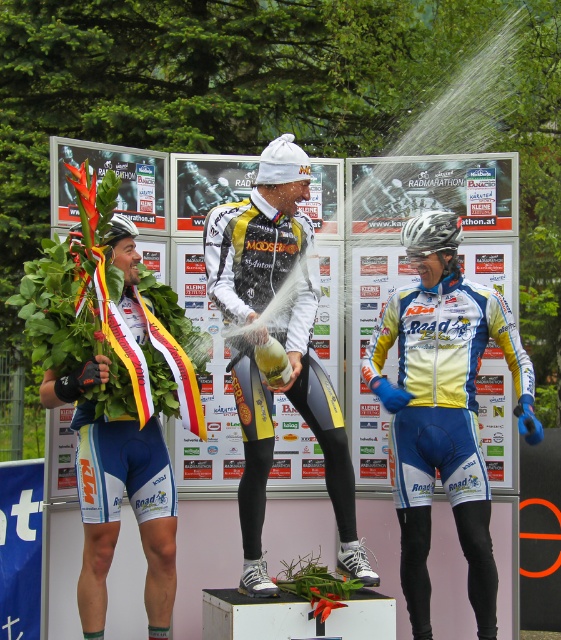
Who is more forward, (237, 300) or (108, 243)?

Positioned in front is point (237, 300).

Can you confirm if yellow and black cycling suit at center is shorter than green matte bicycle helmet at center?

Incorrect, yellow and black cycling suit at center's height does not fall short of green matte bicycle helmet at center's.

Is point (234, 205) behind point (130, 230)?

That is False.

Find the location of a particular element. The image size is (561, 640). yellow and black cycling suit at center is located at coordinates (279, 348).

Who is taller, yellow/white jersey at center or silver metallic helmet at center?

With more height is yellow/white jersey at center.

Image resolution: width=561 pixels, height=640 pixels. What do you see at coordinates (444, 420) in the screenshot?
I see `yellow/white jersey at center` at bounding box center [444, 420].

Find the location of `yellow/white jersey at center`. yellow/white jersey at center is located at coordinates (444, 420).

The height and width of the screenshot is (640, 561). I want to click on yellow/white jersey at center, so click(x=444, y=420).

Measure the distance between point (438, 228) and camera.

The distance of point (438, 228) from camera is 6.62 meters.

Can you confirm if silver metallic helmet at center is positioned to the left of green matte bicycle helmet at center?

Incorrect, silver metallic helmet at center is not on the left side of green matte bicycle helmet at center.

Image resolution: width=561 pixels, height=640 pixels. Describe the element at coordinates (431, 232) in the screenshot. I see `silver metallic helmet at center` at that location.

Locate an element on the screen. The height and width of the screenshot is (640, 561). silver metallic helmet at center is located at coordinates (431, 232).